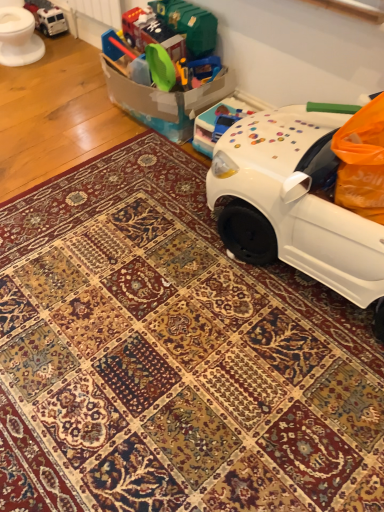
Question: From a real-world perspective, is translucent plastic toy car at upper right, the 2th toy viewed from the back, positioned above or below metallic silver truck at upper left, arranged as the 1th toy when viewed from the top?

Choices:
 (A) above
 (B) below

Answer: (A)

Question: Visually, is translucent plastic toy car at upper right, the 2th toy viewed from the back, positioned to the left or to the right of metallic silver truck at upper left, which appears as the first toy when viewed from the back?

Choices:
 (A) left
 (B) right

Answer: (B)

Question: Which object is the closest to the metallic silver truck at upper left, arranged as the 1th toy when viewed from the top?

Choices:
 (A) white glossy toilet bowl at upper left
 (B) translucent plastic toy car at upper right, acting as the 2th toy starting from the top

Answer: (A)

Question: Which of these objects is positioned farthest from the white glossy toilet bowl at upper left?

Choices:
 (A) metallic silver truck at upper left, which is counted as the 2th toy, starting from the right
 (B) translucent plastic toy car at upper right, the 2th toy viewed from the back

Answer: (B)